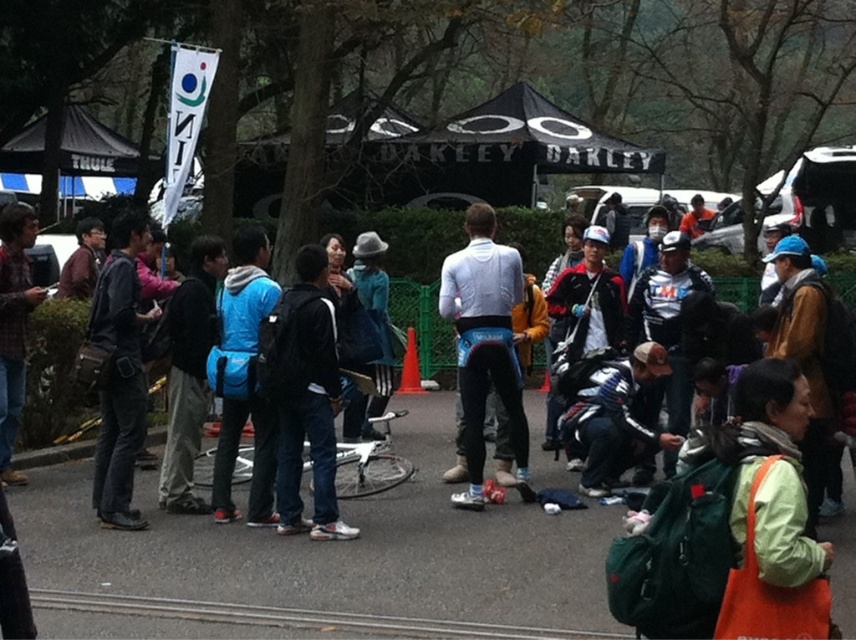
You are a photographer at the event and want to capture a photo that includes both the white matte cycling jersey at center and the black asphalt road at center. Based on their positions, which object should be placed to the right in your photo?

The white matte cycling jersey at center is positioned on the right side of the black asphalt road at center, so in the photo, the white matte cycling jersey at center should be placed to the right of the black asphalt road at center.